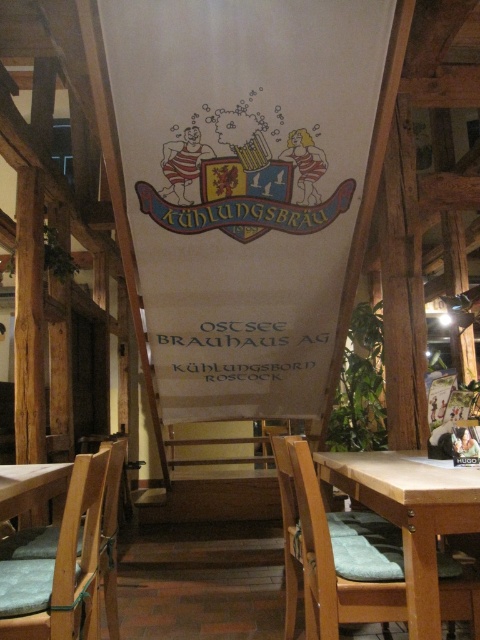
Question: Can you confirm if wooden chair at center is thinner than wooden chair at lower left?

Choices:
 (A) no
 (B) yes

Answer: (A)

Question: Can you confirm if wooden chair at center is positioned to the right of wooden chair at lower left?

Choices:
 (A) yes
 (B) no

Answer: (A)

Question: Which of the following is the closest to the observer?

Choices:
 (A) 98,525
 (B) 441,566

Answer: (B)

Question: Which point is farther to the camera?

Choices:
 (A) wooden chair at center
 (B) wooden chair at lower left

Answer: (A)

Question: Among these objects, which one is nearest to the camera?

Choices:
 (A) wooden chair at lower left
 (B) wooden chair at center

Answer: (A)

Question: Considering the relative positions of wooden chair at center and wooden chair at lower left in the image provided, where is wooden chair at center located with respect to wooden chair at lower left?

Choices:
 (A) above
 (B) below

Answer: (B)